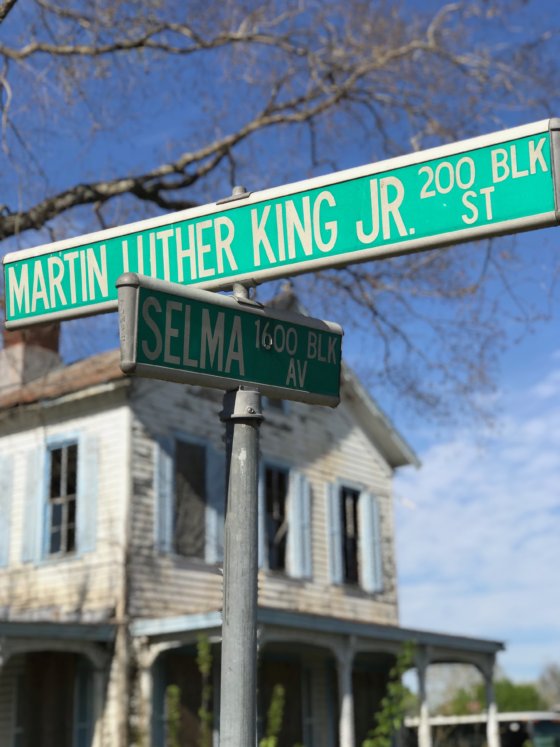
Identify the location of windows. This screenshot has width=560, height=747. (351, 557), (281, 539), (197, 527), (65, 512).